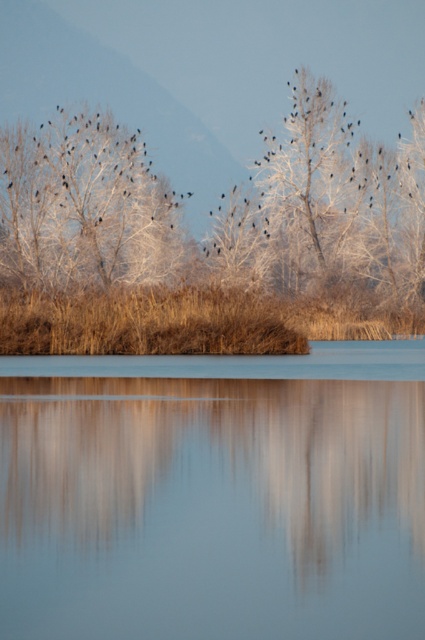
Question: Does smooth glass water at center lie behind white frosty tree at upper left?

Choices:
 (A) no
 (B) yes

Answer: (A)

Question: Can you confirm if smooth glass water at center is positioned below white frosty tree at upper left?

Choices:
 (A) no
 (B) yes

Answer: (B)

Question: Among these objects, which one is farthest from the camera?

Choices:
 (A) smooth glass water at center
 (B) white frosty tree at upper left

Answer: (B)

Question: Does smooth glass water at center have a larger size compared to white frosty tree at upper left?

Choices:
 (A) yes
 (B) no

Answer: (B)

Question: Which point appears closest to the camera in this image?

Choices:
 (A) (65, 227)
 (B) (0, 628)

Answer: (B)

Question: Which object is closer to the camera taking this photo?

Choices:
 (A) smooth glass water at center
 (B) white frosty tree at upper left

Answer: (A)